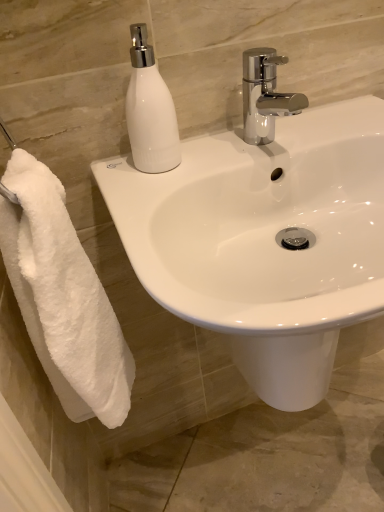
You are a GUI agent. You are given a task and a screenshot of the screen. Output one action in this format:
    pyautogui.click(x=<x>, y=<y>)
    Task: Click on the free spot to the left of white glossy soap dispenser at upper left
    
    Given the screenshot: What is the action you would take?
    pyautogui.click(x=112, y=169)